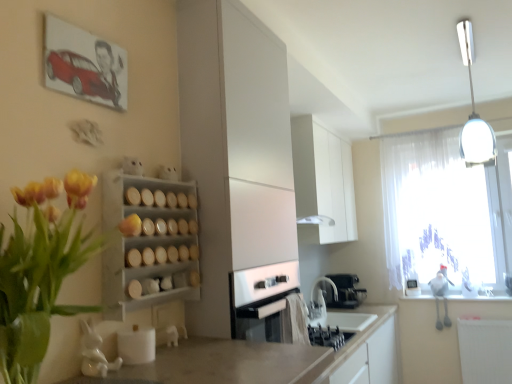
Question: From the image's perspective, does white matte spice rack at center-left appear lower than yellow matte flower at upper left?

Choices:
 (A) no
 (B) yes

Answer: (B)

Question: Does white matte spice rack at center-left touch yellow matte flower at upper left?

Choices:
 (A) yes
 (B) no

Answer: (B)

Question: Considering the relative sizes of white matte spice rack at center-left and yellow matte flower at upper left in the image provided, is white matte spice rack at center-left shorter than yellow matte flower at upper left?

Choices:
 (A) no
 (B) yes

Answer: (A)

Question: Is white matte spice rack at center-left facing away from yellow matte flower at upper left?

Choices:
 (A) yes
 (B) no

Answer: (A)

Question: Can you confirm if white matte spice rack at center-left is positioned to the left of yellow matte flower at upper left?

Choices:
 (A) no
 (B) yes

Answer: (A)

Question: Can you confirm if white matte spice rack at center-left is bigger than yellow matte flower at upper left?

Choices:
 (A) no
 (B) yes

Answer: (B)

Question: Is yellow tulip bouquet at left positioned behind transparent fabric at upper right?

Choices:
 (A) yes
 (B) no

Answer: (B)

Question: Can you confirm if yellow tulip bouquet at left is positioned to the left of transparent fabric at upper right?

Choices:
 (A) no
 (B) yes

Answer: (B)

Question: Does yellow tulip bouquet at left have a smaller size compared to transparent fabric at upper right?

Choices:
 (A) yes
 (B) no

Answer: (A)

Question: Is yellow tulip bouquet at left placed right next to transparent fabric at upper right?

Choices:
 (A) no
 (B) yes

Answer: (A)

Question: Is transparent fabric at upper right at the back of yellow tulip bouquet at left?

Choices:
 (A) no
 (B) yes

Answer: (A)

Question: Is yellow tulip bouquet at left bigger than transparent fabric at upper right?

Choices:
 (A) yes
 (B) no

Answer: (B)

Question: Is the position of black matte coffee machine at lower center more distant than that of white glossy cabinet at upper center, positioned as the first cabinetry in back-to-front order?

Choices:
 (A) no
 (B) yes

Answer: (B)